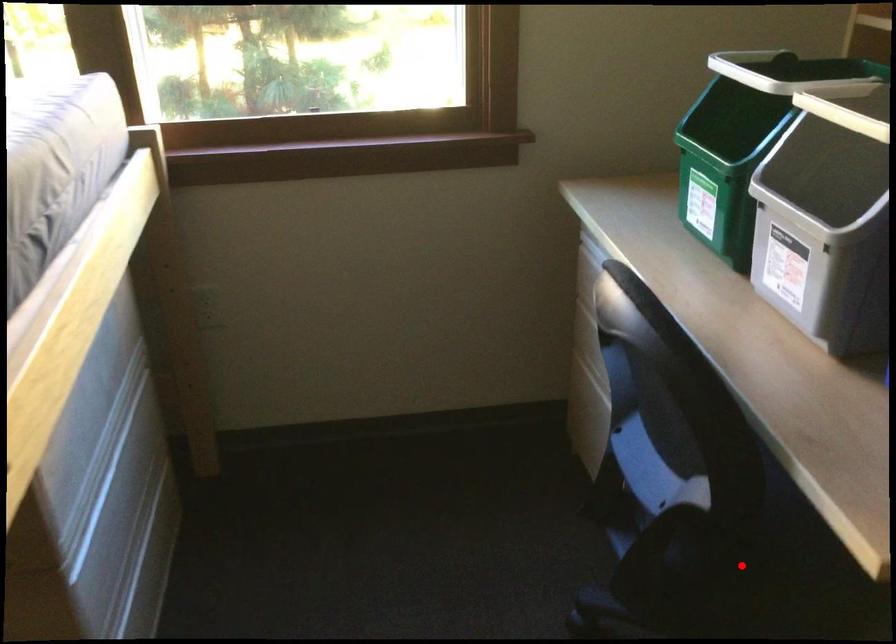
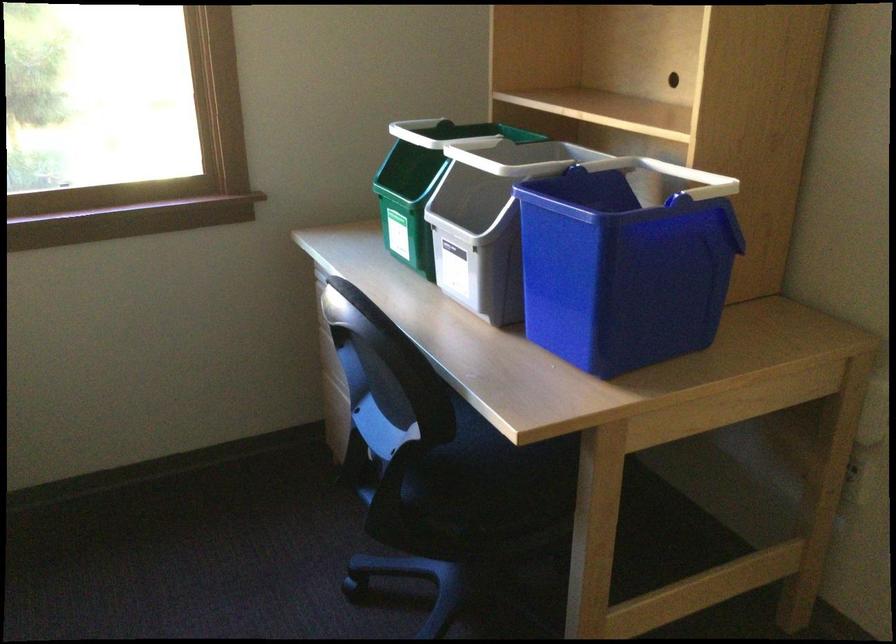
Locate, in the second image, the point that corresponds to the highlighted location in the first image.

(460, 494)